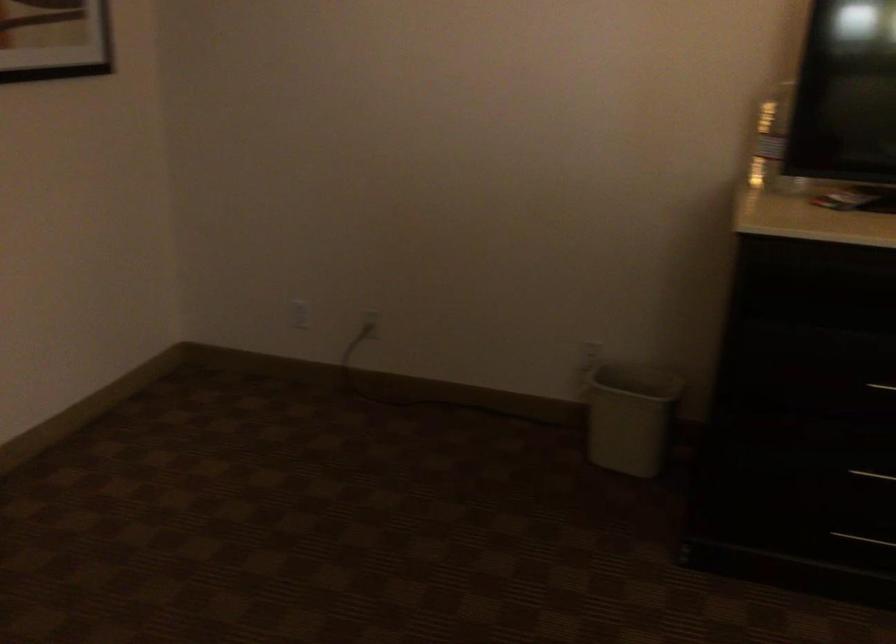
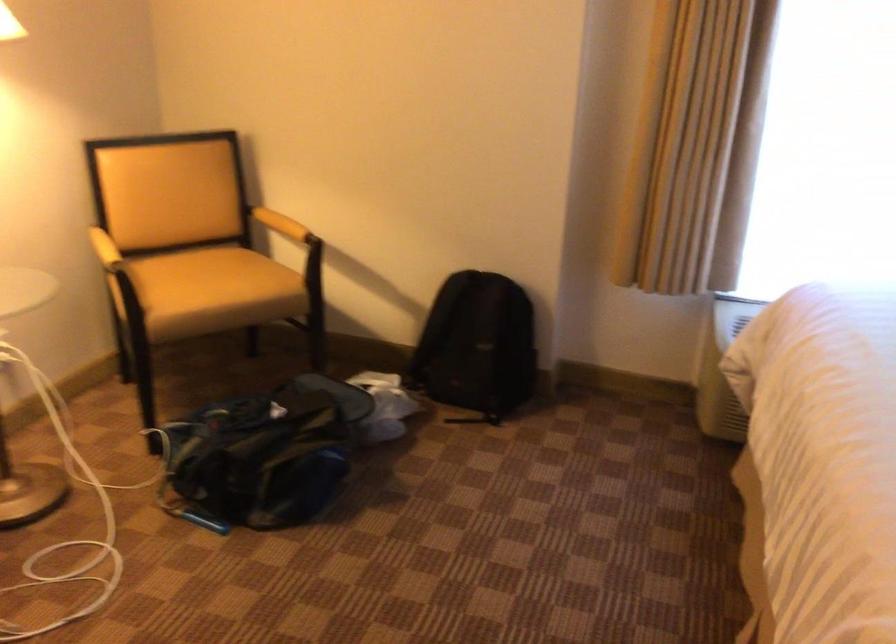
The images are taken continuously from a first-person perspective. In which direction is your viewpoint rotating?

The rotation direction of the camera is right-down.